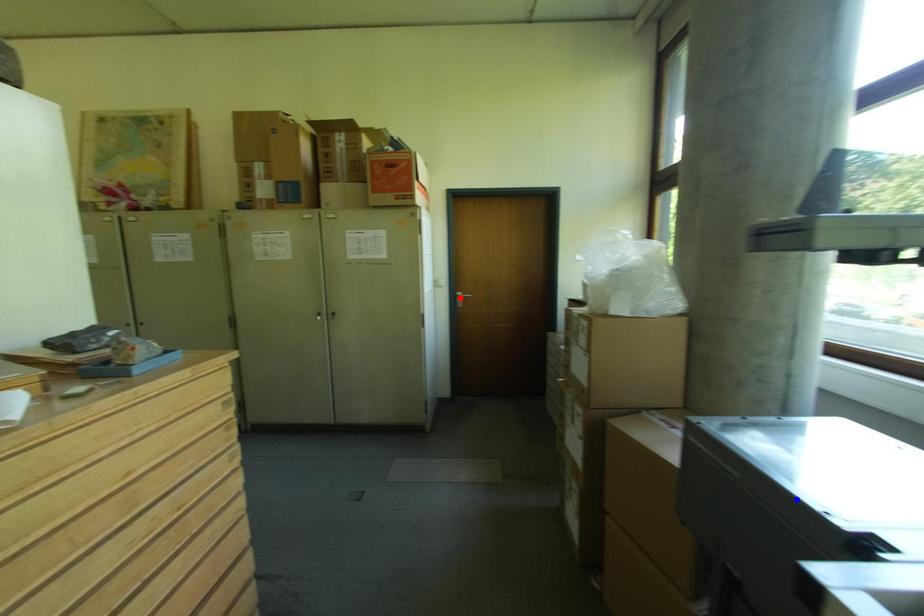
Question: Which of the two points in the image is closer to the camera?

Choices:
 (A) Blue point is closer.
 (B) Red point is closer.

Answer: (A)